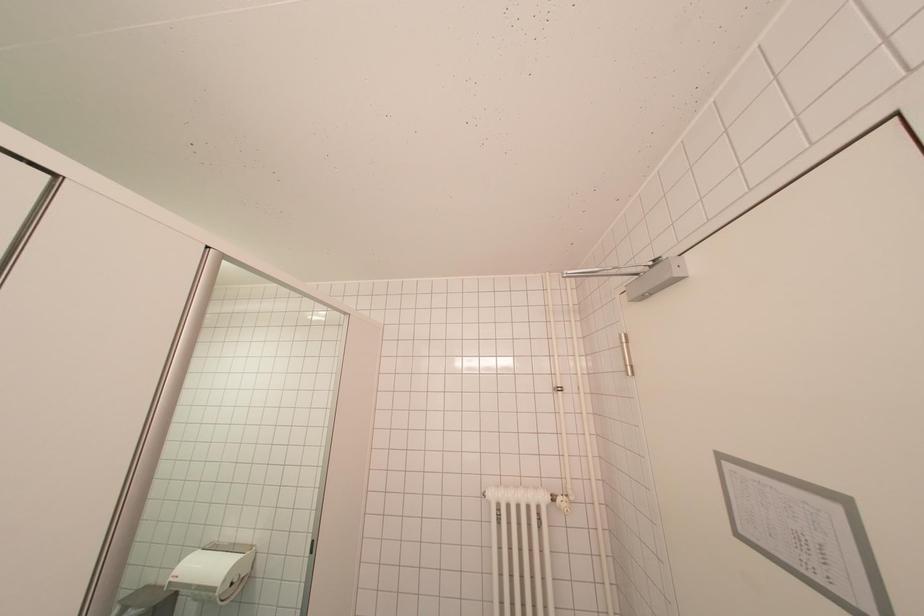
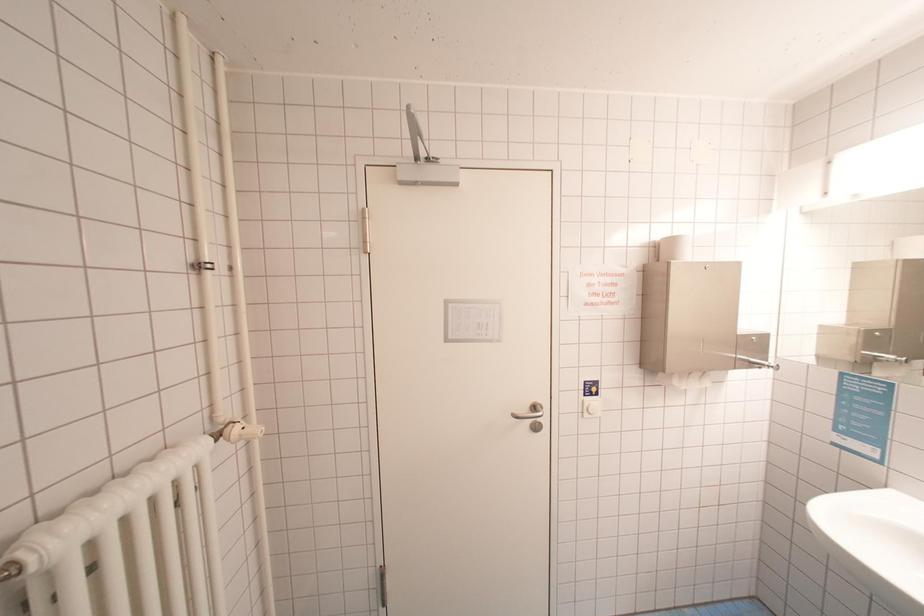
Question: The camera is either moving clockwise (left) or counter-clockwise (right) around the object. The first image is from the beginning of the video and the second image is from the end. Is the camera moving left or right when shooting the video?

Choices:
 (A) Left
 (B) Right

Answer: (A)